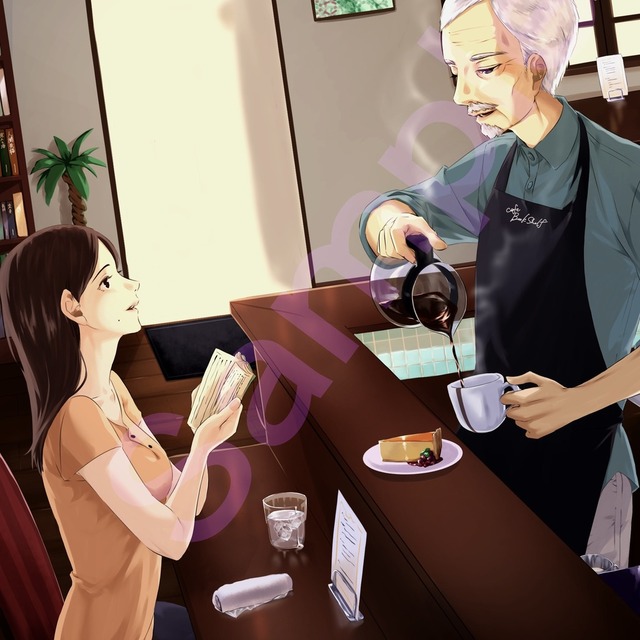
At what (x,y) coordinates should I click in order to perform the action: click on coffee cup. Please return your answer as a coordinate pair (x, y). Looking at the image, I should click on (486, 394).